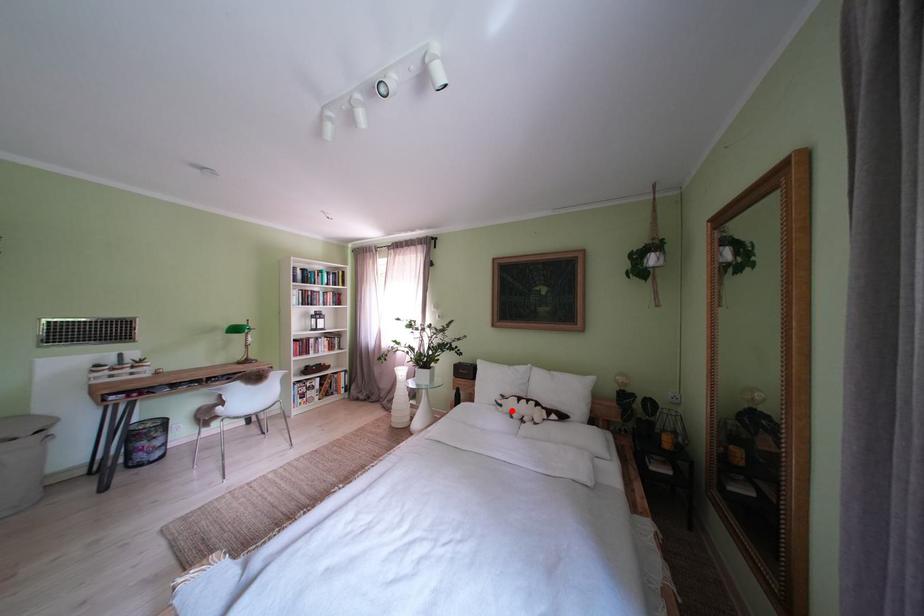
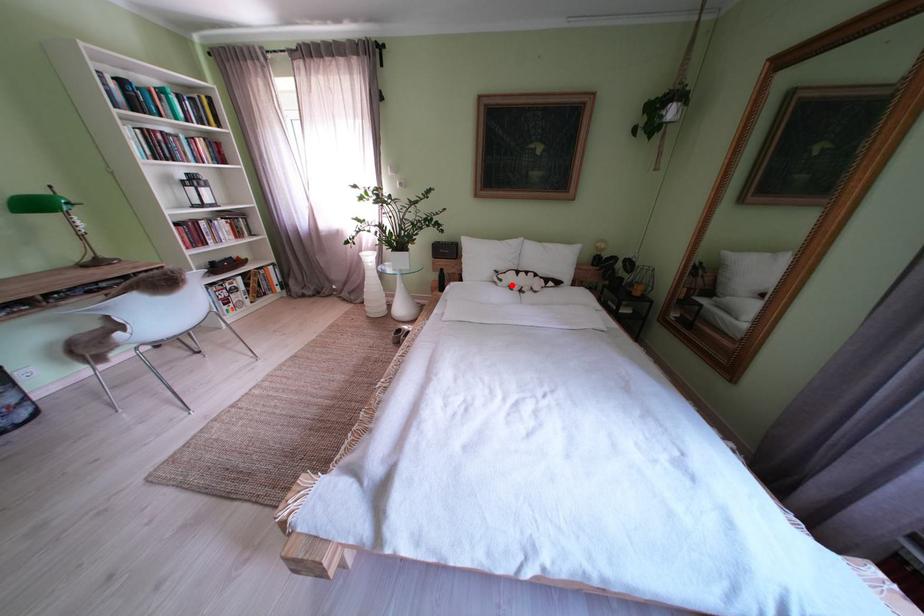
I am providing you with two images of the same scene from different viewpoints. A red point is marked on the first image and another point is marked on the second image. Does the point marked in image1 correspond to the same location as the one in image2?

Yes